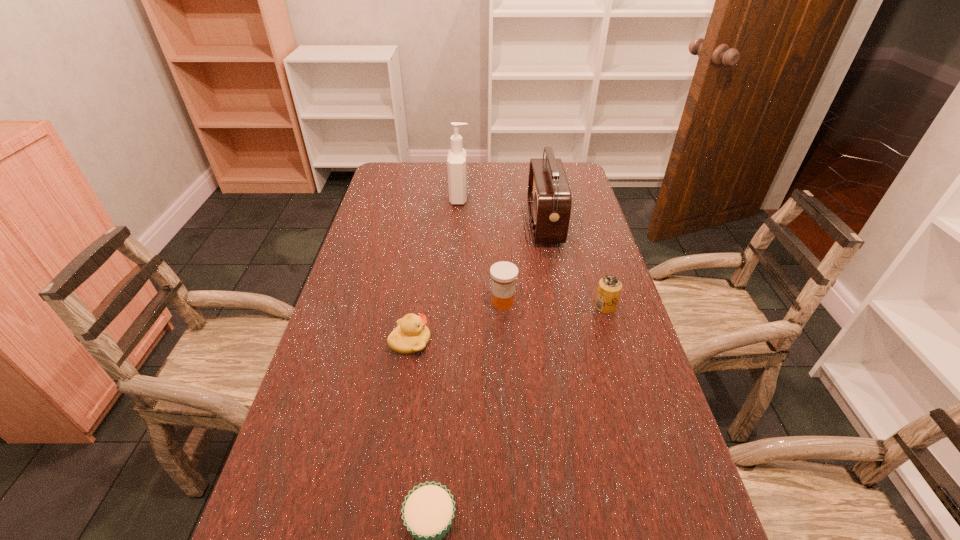
You are a GUI agent. You are given a task and a screenshot of the screen. Output one action in this format:
    pyautogui.click(x=<x>, y=<y>)
    Task: Click on the cleansing agent
    This screenshot has width=960, height=540.
    Given the screenshot: What is the action you would take?
    pyautogui.click(x=457, y=159)

This screenshot has width=960, height=540. What are the coordinates of `the fifth shortest object` in the screenshot? It's located at (549, 200).

In order to click on radio receiver in this screenshot , I will do `click(549, 200)`.

Locate an element on the screen. Image resolution: width=960 pixels, height=540 pixels. medicine is located at coordinates (504, 274).

In order to click on the rightmost object in this screenshot , I will do `click(609, 288)`.

I want to click on the fifth tallest object, so click(x=411, y=335).

The height and width of the screenshot is (540, 960). I want to click on the second nearest object, so click(411, 335).

Locate an element on the screen. vacant space situated 0.050m on the front label of the cleansing agent is located at coordinates (483, 198).

Locate an element on the screen. vacant area located on the front panel of the second tallest object is located at coordinates (423, 224).

Find the location of a particular element. free space located 0.250m on the front panel of the second tallest object is located at coordinates (456, 224).